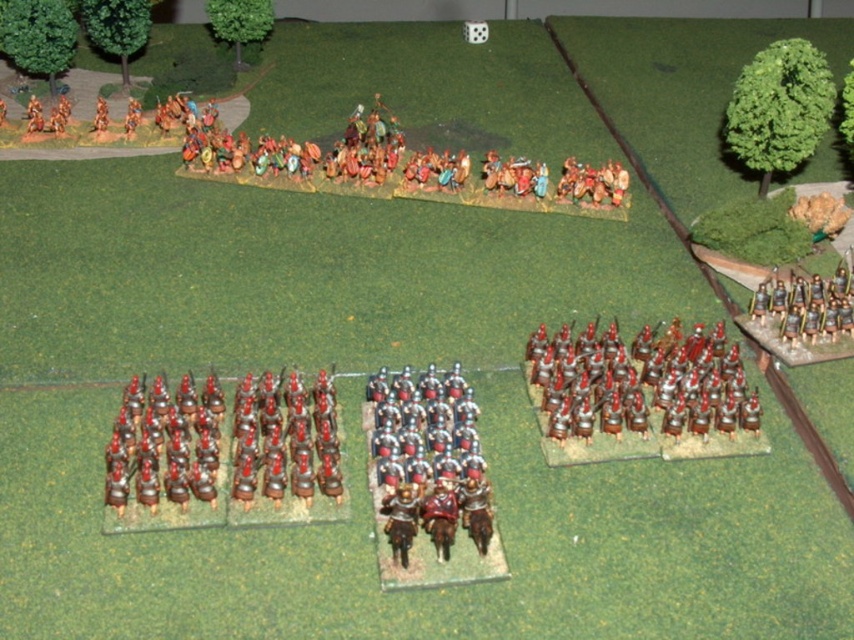
Between point (556, 420) and point (778, 333), which one is positioned in front?

Point (556, 420)

Who is shorter, metallic silver soldiers at center or metallic silver soldiers at right?

metallic silver soldiers at right is shorter.

At what (x,y) coordinates should I click in order to perform the action: click on metallic silver soldiers at center. Please return your answer as a coordinate pair (x, y). The width and height of the screenshot is (854, 640). Looking at the image, I should click on (585, 384).

Does shiny silver armor at center appear under metallic silver soldiers at center?

Correct, shiny silver armor at center is located below metallic silver soldiers at center.

You are a GUI agent. You are given a task and a screenshot of the screen. Output one action in this format:
    pyautogui.click(x=<x>, y=<y>)
    Task: Click on the shiny silver armor at center
    
    Given the screenshot: What is the action you would take?
    pyautogui.click(x=285, y=451)

Does shiny silver helmeted soldiers at center appear on the right side of shiny silver helmets at lower left?

Indeed, shiny silver helmeted soldiers at center is positioned on the right side of shiny silver helmets at lower left.

Can you confirm if shiny silver helmeted soldiers at center is smaller than shiny silver helmets at lower left?

Incorrect, shiny silver helmeted soldiers at center is not smaller in size than shiny silver helmets at lower left.

Find the location of a particular element. The width and height of the screenshot is (854, 640). shiny silver helmeted soldiers at center is located at coordinates (428, 460).